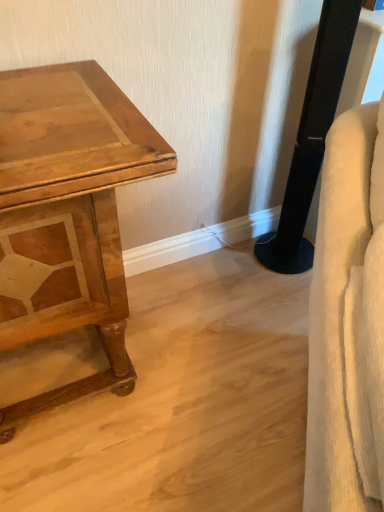
Where is `free space to the left of black plastic speaker at right`? free space to the left of black plastic speaker at right is located at coordinates (230, 267).